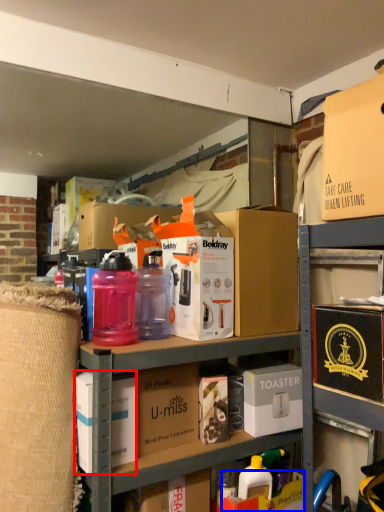
Question: Which of the following is the farthest to the observer, box (highlighted by a red box) or storage box (highlighted by a blue box)?

Choices:
 (A) box
 (B) storage box

Answer: (B)